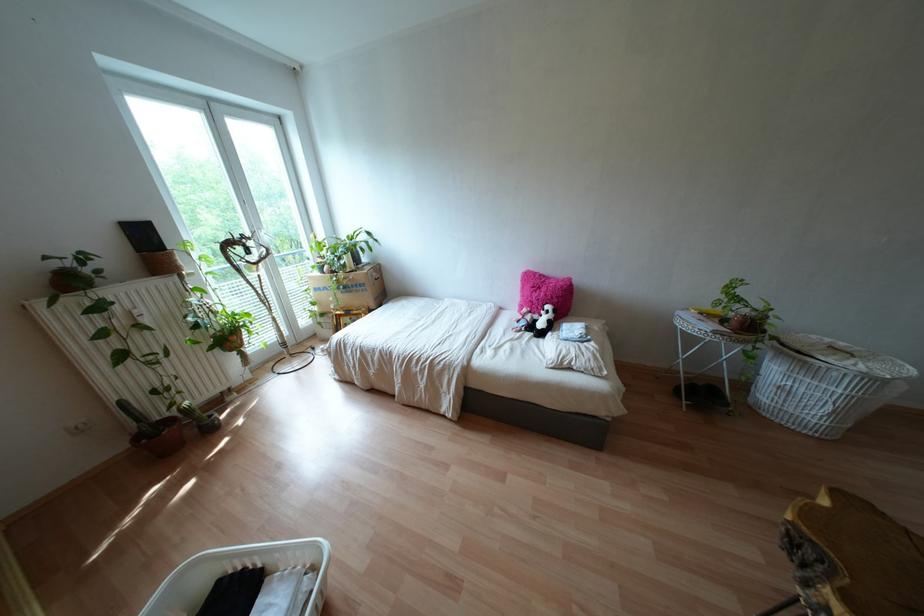
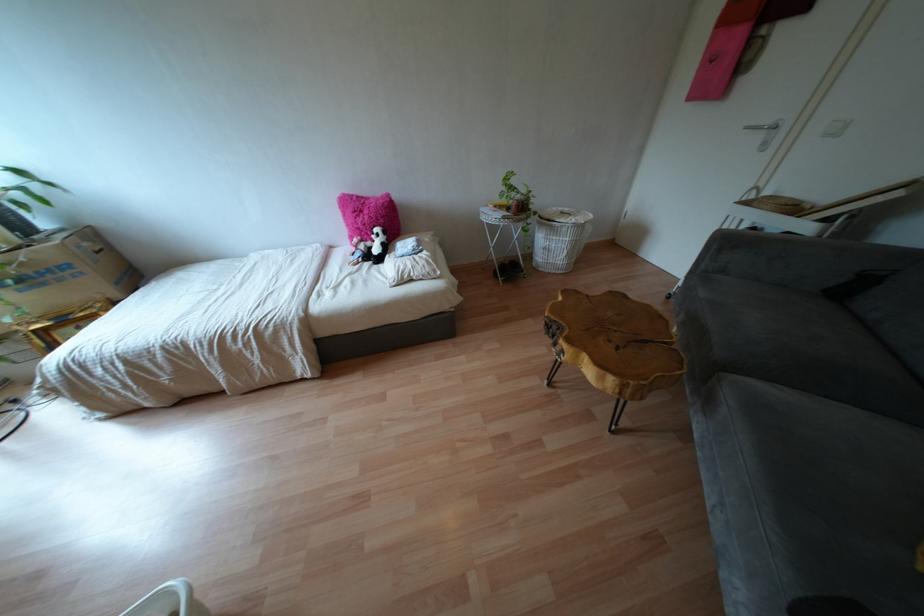
Find the pixel in the second image that matches point 812,336 in the first image.

(553, 208)